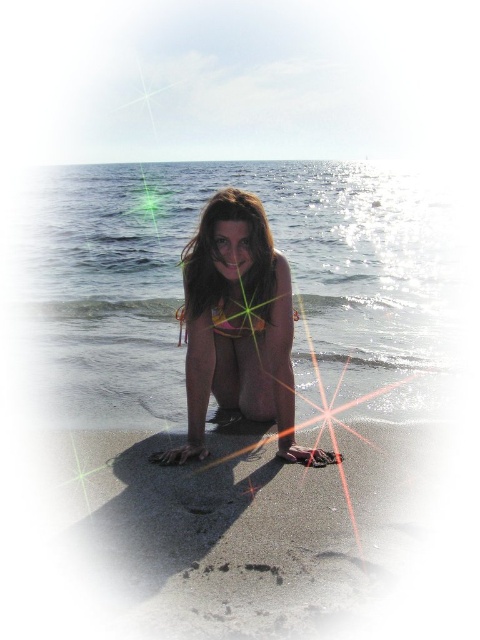
You are a photographer planning to take a closeup shot of the orange bikini at center. Considering the smooth golden sand at lower center, will the sand occupy more space in the photo than the bikini?

The smooth golden sand at lower center has a larger width than the orange bikini at center, so yes, the sand will occupy more space in the photo than the bikini.

You are a photographer trying to capture the perfect shot of the orange bikini at center and the smooth golden sand at lower center. If you want to ensure both elements are in focus, how far apart are they from each other?

The smooth golden sand at lower center is 25.34 inches away from the orange bikini at center, so they are 25.34 inches apart from each other.